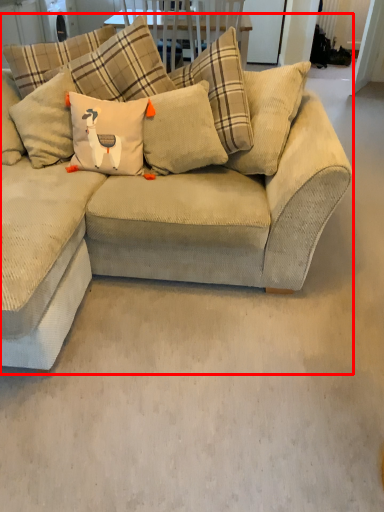
Question: Considering the relative positions of studio couch (annotated by the red box) and pillow in the image provided, where is studio couch (annotated by the red box) located with respect to the staircase?

Choices:
 (A) right
 (B) left

Answer: (B)